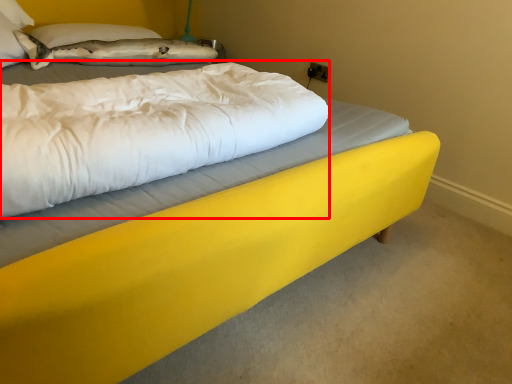
Question: Observing the image, what is the correct spatial positioning of mattress (annotated by the red box) in reference to pillow?

Choices:
 (A) left
 (B) right

Answer: (B)